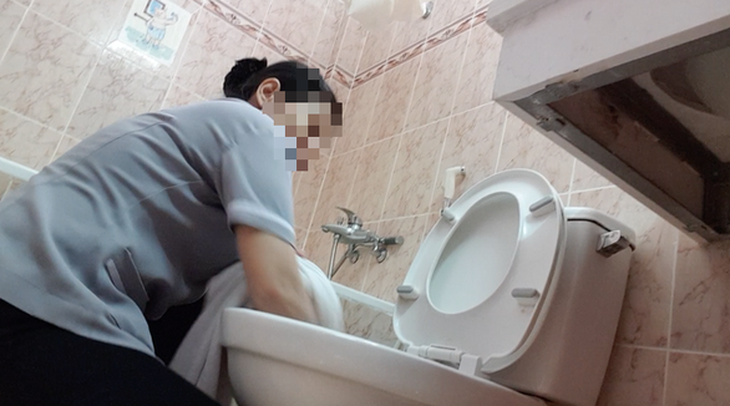
I want to click on tile, so click(x=428, y=133).